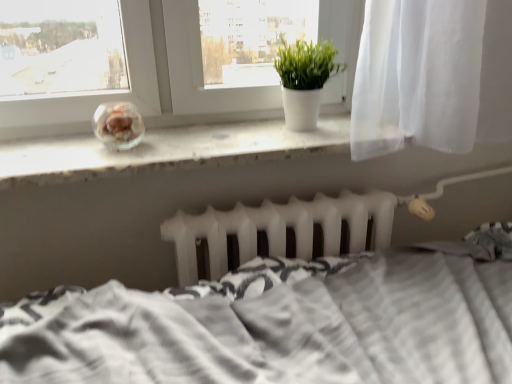
Where is `vacant area located to the right-hand side of translucent glass jar at center`? Image resolution: width=512 pixels, height=384 pixels. vacant area located to the right-hand side of translucent glass jar at center is located at coordinates (182, 142).